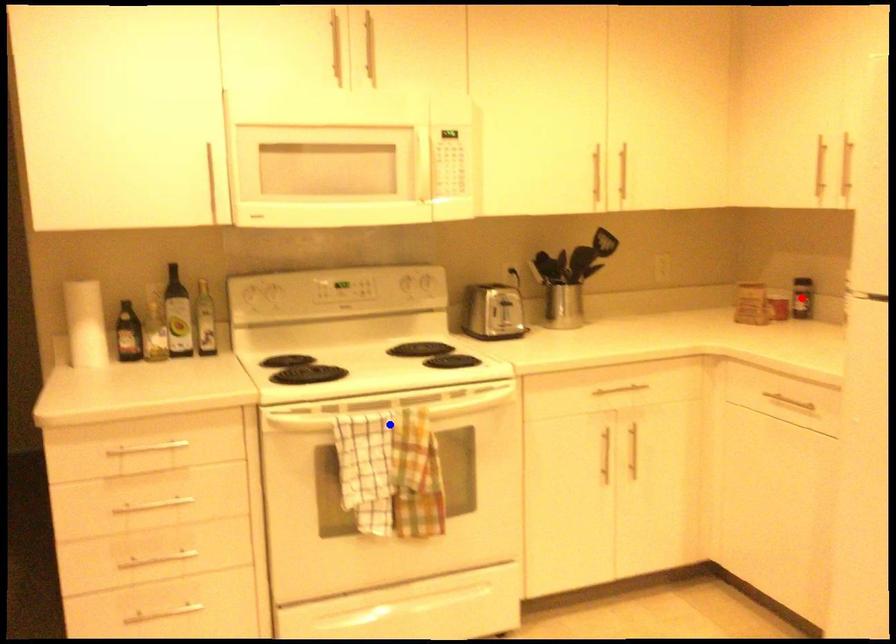
Question: Which of the two points in the image is closer to the camera?

Choices:
 (A) Blue point is closer.
 (B) Red point is closer.

Answer: (A)